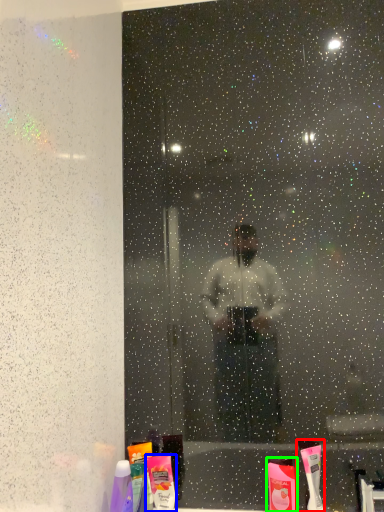
Question: Considering the real-world distances, which object is closest to toothbrush (highlighted by a red box)? toiletry (highlighted by a blue box) or toiletry (highlighted by a green box).

Choices:
 (A) toiletry
 (B) toiletry

Answer: (B)